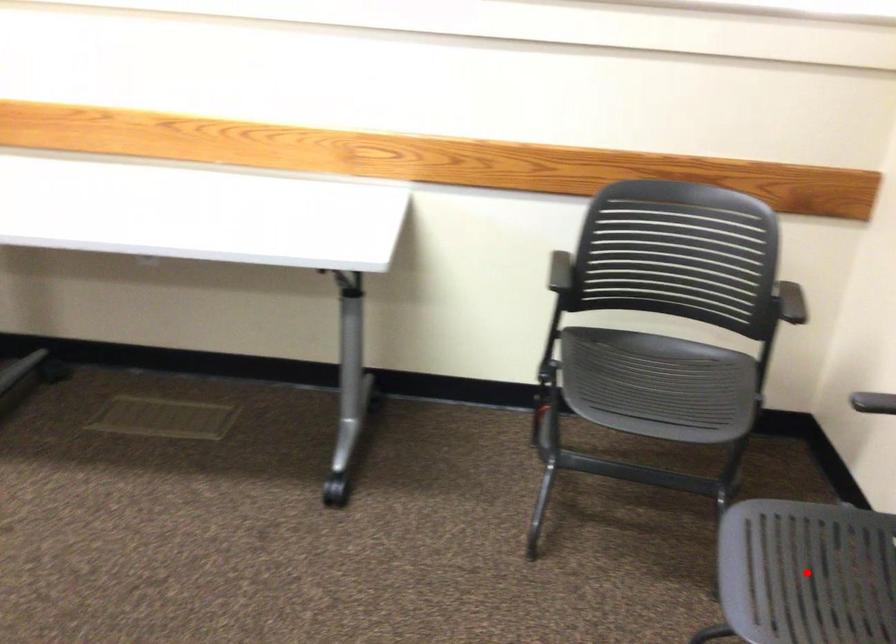
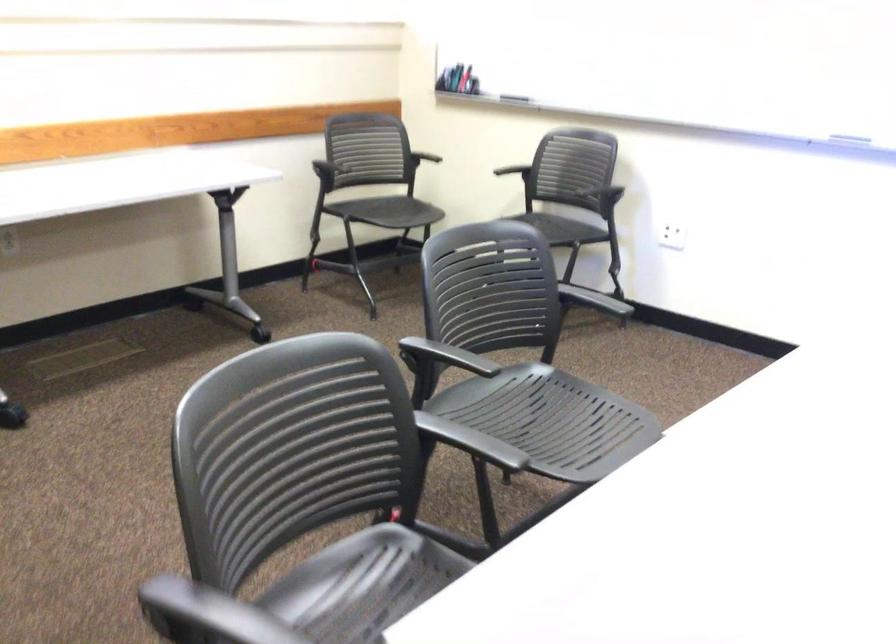
Question: I am providing you with two images of the same scene from different viewpoints. A red point is marked on the first image. Is the red point's position out of view in image 2?

Choices:
 (A) Yes
 (B) No

Answer: (A)